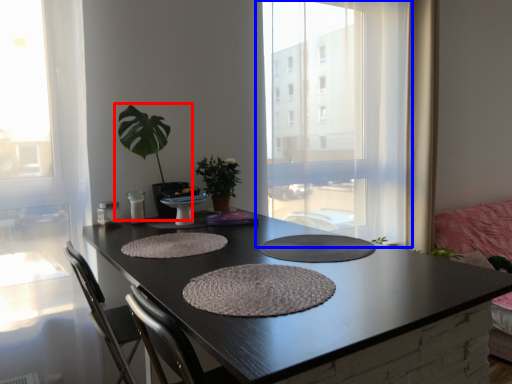
Question: Which object is further to the camera taking this photo, houseplant (highlighted by a red box) or window (highlighted by a blue box)?

Choices:
 (A) houseplant
 (B) window

Answer: (B)